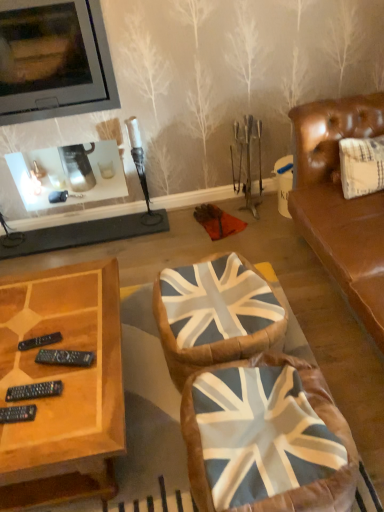
At what (x,y) coordinates should I click in order to perform the action: click on free location to the right of union jack fabric swivel chair at center, the 1th swivel chair when ordered from back to front. Please return your answer as a coordinate pair (x, y). The height and width of the screenshot is (512, 384). Looking at the image, I should click on (328, 336).